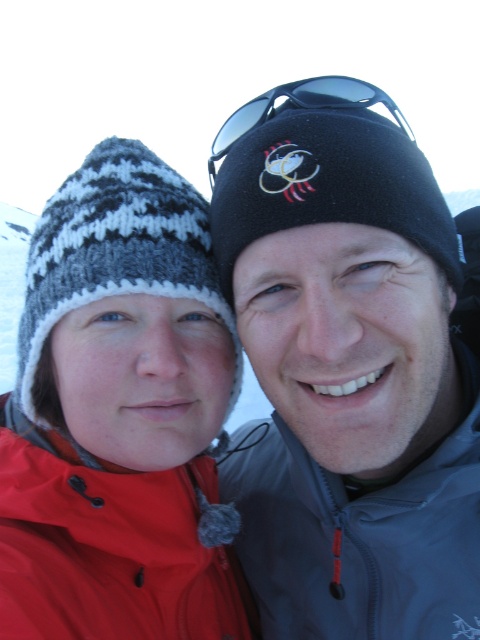
Is knitted woolen hat at left thinner than matte red jacket at lower left?

Yes, knitted woolen hat at left is thinner than matte red jacket at lower left.

Does knitted woolen hat at left have a greater height compared to matte red jacket at lower left?

Yes, knitted woolen hat at left is taller than matte red jacket at lower left.

The width and height of the screenshot is (480, 640). I want to click on knitted woolen hat at left, so click(120, 417).

Where is `knitted woolen hat at left`? The width and height of the screenshot is (480, 640). knitted woolen hat at left is located at coordinates (120, 417).

This screenshot has height=640, width=480. What do you see at coordinates (120, 417) in the screenshot?
I see `knitted woolen hat at left` at bounding box center [120, 417].

Is knitted woolen hat at left bigger than black fleece beanie at upper center?

Yes, knitted woolen hat at left is bigger than black fleece beanie at upper center.

Which is in front, point (70, 225) or point (211, 208)?

Point (70, 225) is in front.

Find the location of `knitted woolen hat at left`. knitted woolen hat at left is located at coordinates (120, 417).

You are a GUI agent. You are given a task and a screenshot of the screen. Output one action in this format:
    pyautogui.click(x=<x>, y=<y>)
    Task: Click on the black fleece beanie at upper center
    Image resolution: width=480 pixels, height=640 pixels.
    Given the screenshot: What is the action you would take?
    pyautogui.click(x=327, y=182)

Who is higher up, black fleece beanie at upper center or sunglasses at upper center?

sunglasses at upper center is above.

Who is more distant from viewer, (320, 147) or (224, 136)?

The point (224, 136) is behind.

The height and width of the screenshot is (640, 480). I want to click on black fleece beanie at upper center, so click(x=327, y=182).